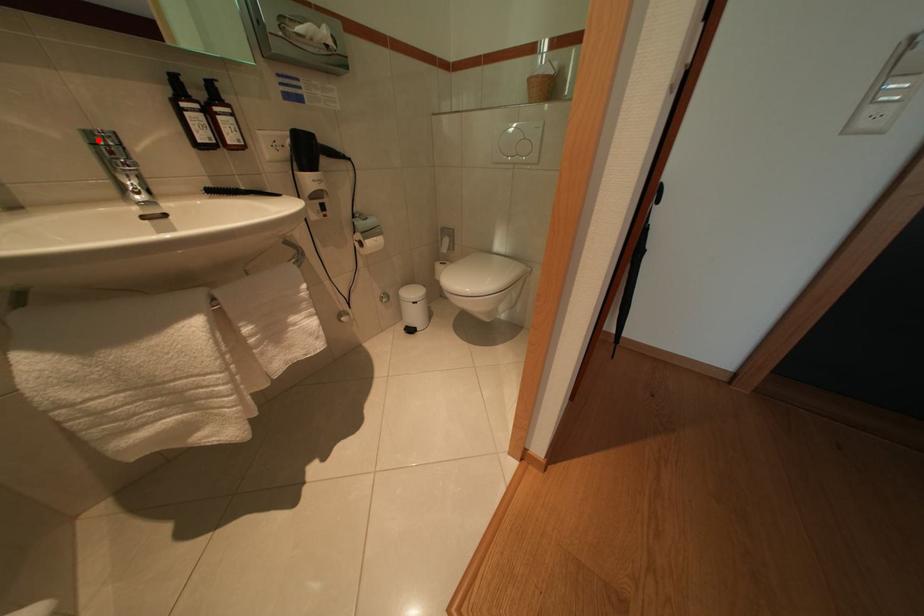
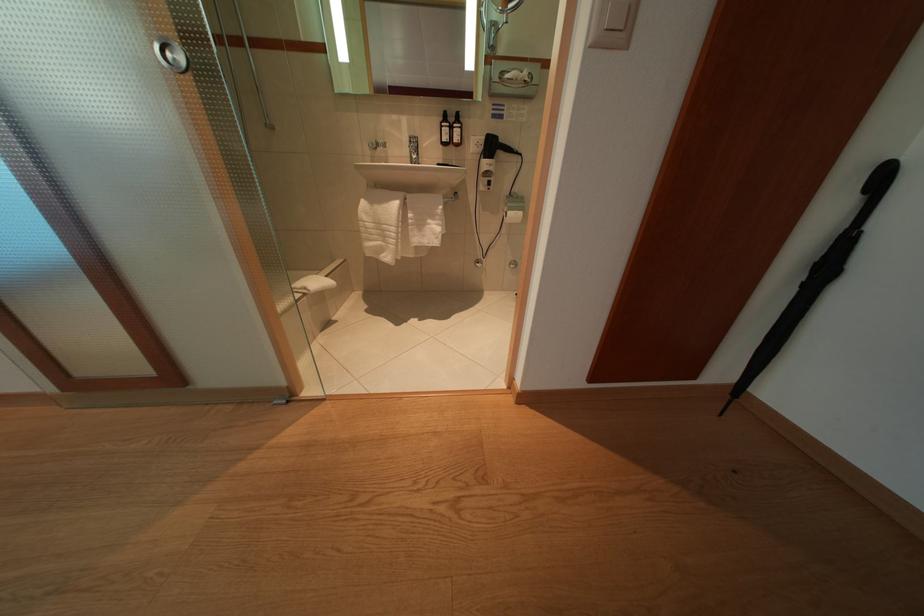
Find the pixel in the second image that matches the highlighted location in the first image.

(419, 143)